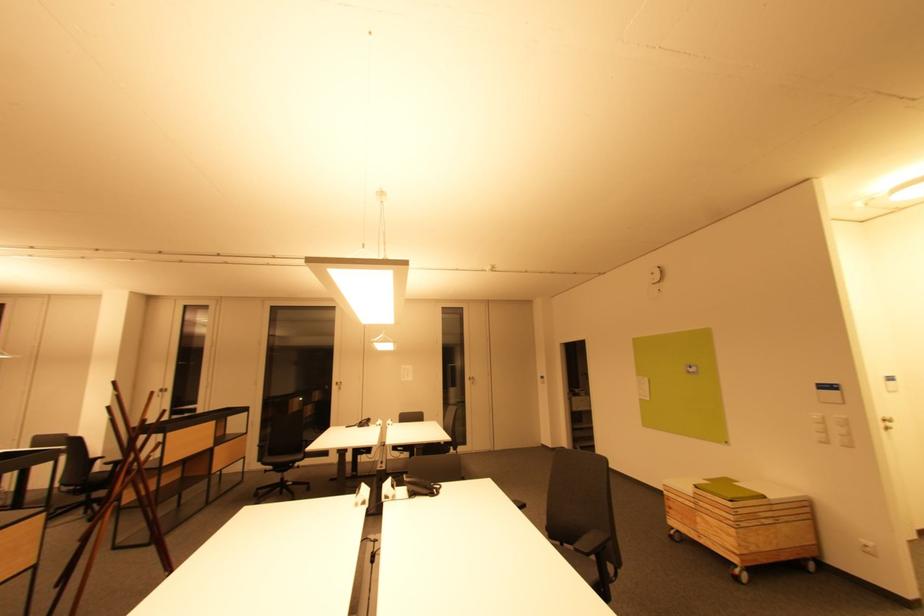
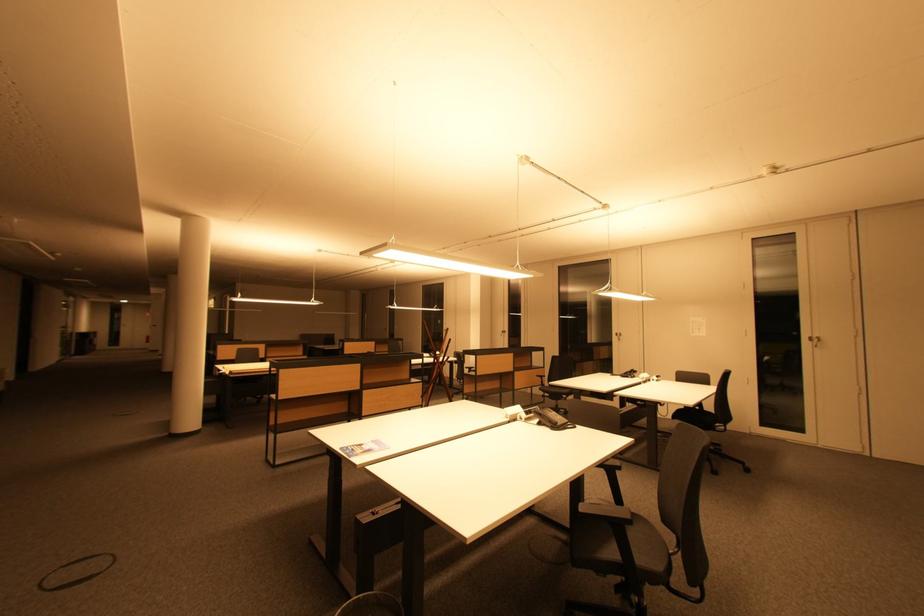
The point at (370, 424) is marked in the first image. Where is the corresponding point in the second image?

(635, 376)